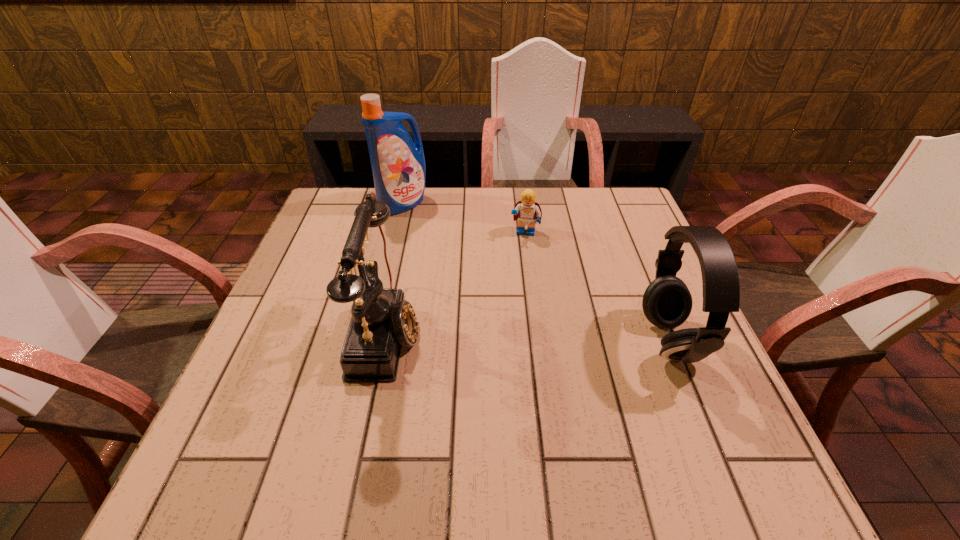
Locate an element on the screen. vacant space located 0.220m on the front-facing side of the third object from left to right is located at coordinates (513, 297).

In order to click on vacant point located 0.130m on the front-facing side of the third object from left to right in this screenshot , I will do `click(517, 272)`.

At what (x,y) coordinates should I click in order to perform the action: click on free space located 0.280m on the label of the detergent. Please return your answer as a coordinate pair (x, y). The width and height of the screenshot is (960, 540). Looking at the image, I should click on (451, 273).

Identify the location of free region located 0.220m on the label of the detergent. (442, 259).

The width and height of the screenshot is (960, 540). Identify the location of vacant space located on the label of the detergent. (446, 266).

Image resolution: width=960 pixels, height=540 pixels. Find the location of `Lego situated at the far edge`. Lego situated at the far edge is located at coordinates (527, 210).

In order to click on detergent positioned at the far edge in this screenshot , I will do `click(398, 165)`.

I want to click on object that is positioned at the near edge, so click(382, 321).

Where is `object that is at the left edge`? object that is at the left edge is located at coordinates (398, 165).

Identify the location of object located in the right edge section of the desktop. The height and width of the screenshot is (540, 960). (667, 302).